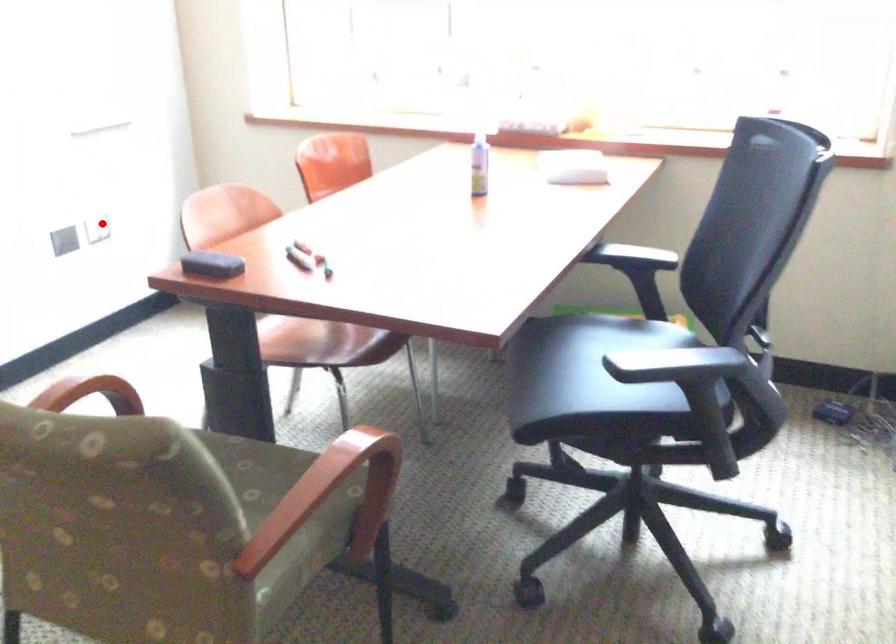
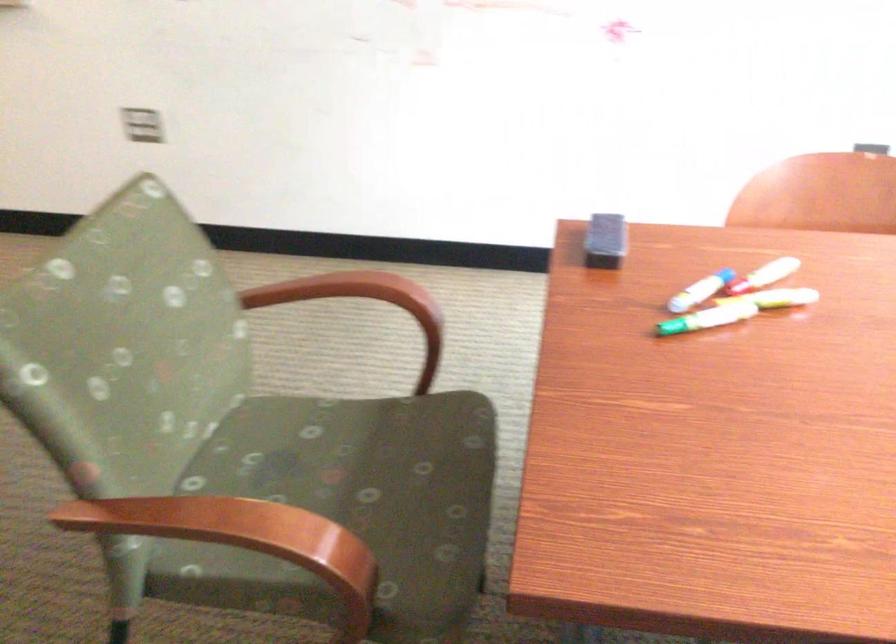
Locate, in the second image, the point that corresponds to the highlighted location in the first image.

(871, 147)